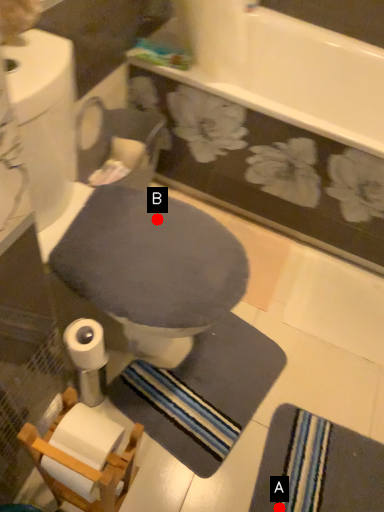
Question: Two points are circled on the image, labeled by A and B beside each circle. Among these points, which one is farthest from the camera?

Choices:
 (A) A is further
 (B) B is further

Answer: (A)